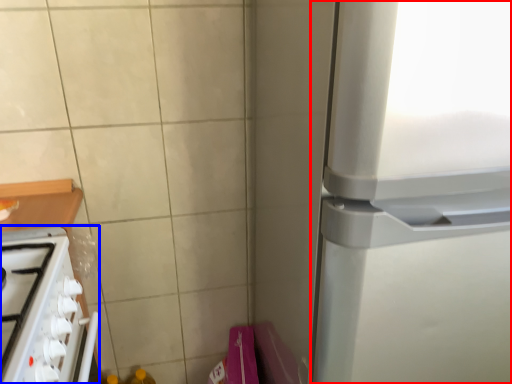
Question: Which of the following is the closest to the observer, refrigerator (highlighted by a red box) or home appliance (highlighted by a blue box)?

Choices:
 (A) refrigerator
 (B) home appliance

Answer: (A)